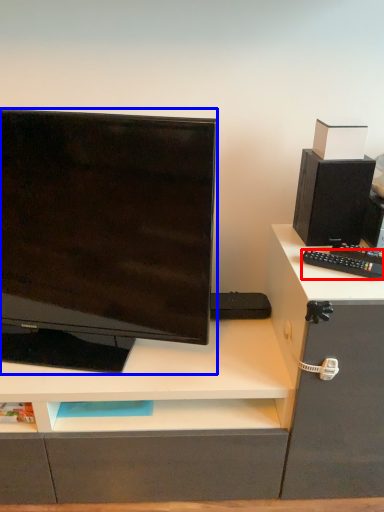
Question: Which point is closer to the camera, remote control (highlighted by a red box) or computer monitor (highlighted by a blue box)?

Choices:
 (A) remote control
 (B) computer monitor

Answer: (B)